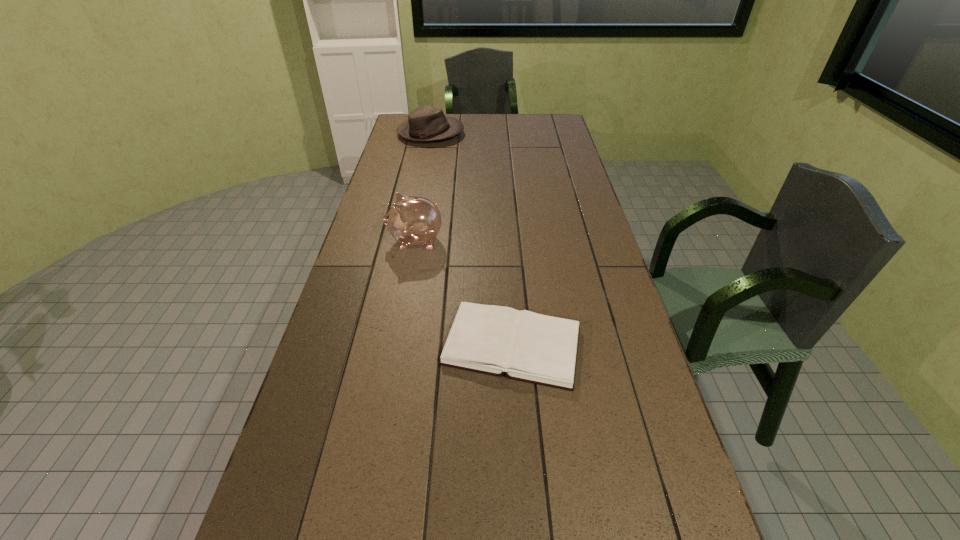
Where is `hat that is positioned at the left edge`? hat that is positioned at the left edge is located at coordinates (426, 123).

Locate an element on the screen. The height and width of the screenshot is (540, 960). object situated at the right edge is located at coordinates (526, 346).

At what (x,y) coordinates should I click in order to perform the action: click on object present at the far left corner. Please return your answer as a coordinate pair (x, y). The height and width of the screenshot is (540, 960). Looking at the image, I should click on (426, 123).

What are the coordinates of `vacant space at the far edge of the desktop` in the screenshot? It's located at click(x=467, y=124).

Identify the location of vacant area at the left edge. The width and height of the screenshot is (960, 540). (392, 149).

Locate an element on the screen. This screenshot has height=540, width=960. vacant space at the right edge of the desktop is located at coordinates (592, 321).

Where is `free space between the hat and the shortest object`? This screenshot has width=960, height=540. free space between the hat and the shortest object is located at coordinates (471, 240).

You are a GUI agent. You are given a task and a screenshot of the screen. Output one action in this format:
    pyautogui.click(x=<x>, y=<y>)
    Task: Click on the empty space between the second shortest object and the shortest object
    
    Given the screenshot: What is the action you would take?
    pyautogui.click(x=471, y=240)

Locate an element on the screen. This screenshot has width=960, height=540. free spot between the farthest object and the shortest object is located at coordinates (471, 240).

Identify the location of free space between the farthest object and the second farthest object. Image resolution: width=960 pixels, height=540 pixels. (423, 187).